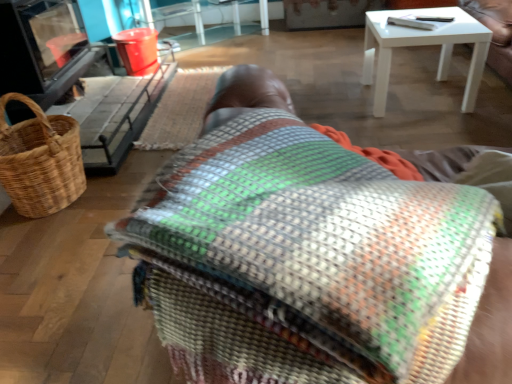
Identify the location of multicolored woven blanket at center. (306, 260).

Based on the photo, considering the relative sizes of woven fabric mat at upper center and multicolored woven blanket at center in the image provided, is woven fabric mat at upper center wider than multicolored woven blanket at center?

Incorrect, the width of woven fabric mat at upper center does not surpass that of multicolored woven blanket at center.

Between woven fabric mat at upper center and multicolored woven blanket at center, which one appears on the right side from the viewer's perspective?

multicolored woven blanket at center.

Where is `mat lying behind the multicolored woven blanket at center`? This screenshot has width=512, height=384. mat lying behind the multicolored woven blanket at center is located at coordinates (180, 109).

From the image's perspective, does woven fabric mat at upper center appear lower than multicolored woven blanket at center?

Actually, woven fabric mat at upper center appears above multicolored woven blanket at center in the image.

Does multicolored woven blanket at center turn towards brown woven picnic basket at left?

No, multicolored woven blanket at center is not oriented towards brown woven picnic basket at left.

From the image's perspective, is multicolored woven blanket at center located above or below brown woven picnic basket at left?

Clearly, from the image's perspective, multicolored woven blanket at center is below brown woven picnic basket at left.

Are multicolored woven blanket at center and brown woven picnic basket at left beside each other?

No, multicolored woven blanket at center is not with brown woven picnic basket at left.

Which object is positioned more to the left, multicolored woven blanket at center or brown woven picnic basket at left?

brown woven picnic basket at left.

In the scene shown: Between brown woven picnic basket at left and translucent plastic table at upper center, which one appears on the left side from the viewer's perspective?

Positioned to the left is brown woven picnic basket at left.

Could you tell me if brown woven picnic basket at left is turned towards translucent plastic table at upper center?

No, brown woven picnic basket at left is not aimed at translucent plastic table at upper center.

Is the position of brown woven picnic basket at left more distant than that of translucent plastic table at upper center?

That is False.

Is brown woven picnic basket at left taller than translucent plastic table at upper center?

Indeed, brown woven picnic basket at left has a greater height compared to translucent plastic table at upper center.

Would you say multicolored woven blanket at center is to the left or to the right of woven fabric mat at upper center in the picture?

Based on their positions, multicolored woven blanket at center is located to the right of woven fabric mat at upper center.

Between point (175, 295) and point (164, 109), which one is positioned in front?

Point (175, 295)

Based on the photo, from the image's perspective, is multicolored woven blanket at center above or below woven fabric mat at upper center?

multicolored woven blanket at center is below woven fabric mat at upper center.

Would you say multicolored woven blanket at center is a long distance from woven fabric mat at upper center?

multicolored woven blanket at center is positioned a significant distance from woven fabric mat at upper center.

Can you confirm if woven fabric mat at upper center is smaller than brown woven picnic basket at left?

Indeed, woven fabric mat at upper center has a smaller size compared to brown woven picnic basket at left.

Between woven fabric mat at upper center and brown woven picnic basket at left, which one has larger width?

Wider between the two is woven fabric mat at upper center.

You are a GUI agent. You are given a task and a screenshot of the screen. Output one action in this format:
    pyautogui.click(x=<x>, y=<y>)
    Task: Click on the mat lying on the right of brown woven picnic basket at left
    
    Given the screenshot: What is the action you would take?
    pyautogui.click(x=180, y=109)

Can you tell me how much woven fabric mat at upper center and brown woven picnic basket at left differ in facing direction?

0.00177 degrees.

In the scene shown: Who is smaller, translucent plastic table at upper center or woven fabric mat at upper center?

Smaller between the two is woven fabric mat at upper center.

Is translucent plastic table at upper center at the left side of woven fabric mat at upper center?

Yes.

Consider the image. Is translucent plastic table at upper center facing towards woven fabric mat at upper center?

Yes, translucent plastic table at upper center faces towards woven fabric mat at upper center.

Is translucent plastic table at upper center not inside woven fabric mat at upper center?

Indeed, translucent plastic table at upper center is completely outside woven fabric mat at upper center.

Is translucent plastic table at upper center closer to the viewer compared to multicolored woven blanket at center?

No.

Based on the photo, how different are the orientations of translucent plastic table at upper center and multicolored woven blanket at center in degrees?

142 degrees.

From the image's perspective, which object appears higher, translucent plastic table at upper center or multicolored woven blanket at center?

translucent plastic table at upper center, from the image's perspective.

Where is `mat behind the multicolored woven blanket at center`? This screenshot has height=384, width=512. mat behind the multicolored woven blanket at center is located at coordinates (180, 109).

This screenshot has height=384, width=512. What are the coordinates of `blanket located on the right of brown woven picnic basket at left` in the screenshot? It's located at (306, 260).

Looking at the image, which one is located closer to multicolored woven blanket at center, woven fabric mat at upper center or brown woven picnic basket at left?

brown woven picnic basket at left is closer to multicolored woven blanket at center.

From the image, which object appears to be nearer to translucent plastic table at upper center, woven fabric mat at upper center or multicolored woven blanket at center?

woven fabric mat at upper center is positioned closer to the anchor translucent plastic table at upper center.

Based on their spatial positions, is translucent plastic table at upper center or multicolored woven blanket at center closer to brown woven picnic basket at left?

multicolored woven blanket at center.

Considering their positions, is woven fabric mat at upper center positioned closer to brown woven picnic basket at left than multicolored woven blanket at center?

woven fabric mat at upper center lies closer to brown woven picnic basket at left than the other object.

From the picture: When comparing their distances from translucent plastic table at upper center, does multicolored woven blanket at center or woven fabric mat at upper center seem further?

Among the two, multicolored woven blanket at center is located further to translucent plastic table at upper center.

Looking at the image, which one is located closer to woven fabric mat at upper center, translucent plastic table at upper center or brown woven picnic basket at left?

brown woven picnic basket at left lies closer to woven fabric mat at upper center than the other object.

When comparing their distances from woven fabric mat at upper center, does multicolored woven blanket at center or brown woven picnic basket at left seem further?

multicolored woven blanket at center lies further to woven fabric mat at upper center than the other object.

When comparing their distances from translucent plastic table at upper center, does brown woven picnic basket at left or woven fabric mat at upper center seem closer?

The object closer to translucent plastic table at upper center is woven fabric mat at upper center.

Find the location of a particular element. The image size is (512, 384). mat between brown woven picnic basket at left and translucent plastic table at upper center in the front-back direction is located at coordinates (180, 109).

You are a GUI agent. You are given a task and a screenshot of the screen. Output one action in this format:
    pyautogui.click(x=<x>, y=<y>)
    Task: Click on the mat positioned between multicolored woven blanket at center and translucent plastic table at upper center from near to far
    
    Given the screenshot: What is the action you would take?
    pyautogui.click(x=180, y=109)

Locate an element on the screen. This screenshot has height=384, width=512. picnic basket positioned between multicolored woven blanket at center and translucent plastic table at upper center from near to far is located at coordinates (40, 160).

I want to click on picnic basket between multicolored woven blanket at center and woven fabric mat at upper center in the front-back direction, so click(40, 160).